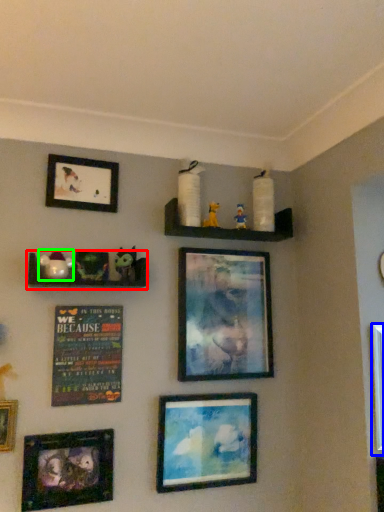
Question: Which is farther away from shelf (highlighted by a red box)? picture frame (highlighted by a blue box) or toy (highlighted by a green box)?

Choices:
 (A) picture frame
 (B) toy

Answer: (A)